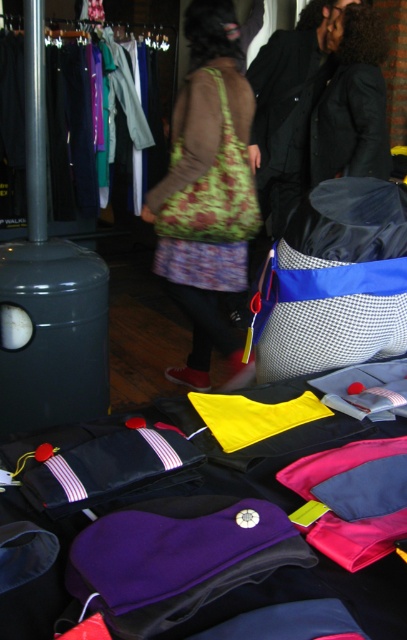
Is blue and white checkered bag at center above green textured bag at center?

No, blue and white checkered bag at center is not above green textured bag at center.

Who is more distant from viewer, (382, 307) or (253, 188)?

Positioned behind is point (253, 188).

Find the location of a particular element. The image size is (407, 640). blue and white checkered bag at center is located at coordinates (334, 280).

Locate an element on the screen. The height and width of the screenshot is (640, 407). blue and white checkered bag at center is located at coordinates (334, 280).

Identify the location of black wool coat at upper right. This screenshot has width=407, height=640. (284, 116).

Is point (269, 68) closer to viewer compared to point (380, 106)?

No, it is not.

I want to click on black wool coat at upper right, so click(x=284, y=116).

Is blue and white checkered bag at center further to the viewer compared to black leather jacket at upper right?

No, blue and white checkered bag at center is closer to the viewer.

Who is more forward, (372, 260) or (374, 138)?

Point (372, 260) is more forward.

Image resolution: width=407 pixels, height=640 pixels. I want to click on blue and white checkered bag at center, so click(334, 280).